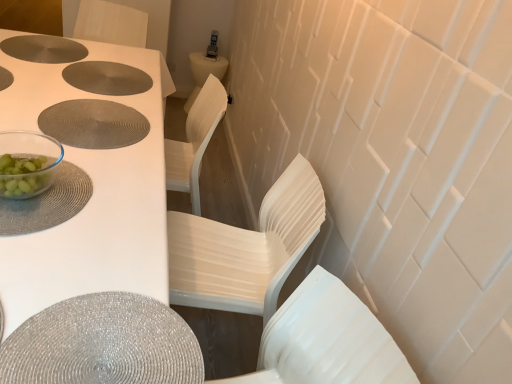
This screenshot has height=384, width=512. What do you see at coordinates (326, 340) in the screenshot?
I see `white plastic chair at center, acting as the second chair starting from the back` at bounding box center [326, 340].

In order to face matte silver placemat at center, the third hole positioned from the top, should I rotate leftwards or rightwards?

To face it directly, rotate left by 20.624 degrees.

Locate an element on the screen. white glossy table at upper left is located at coordinates (90, 200).

Where is `white plastic chair at center, the 2th chair viewed from the front`? The width and height of the screenshot is (512, 384). white plastic chair at center, the 2th chair viewed from the front is located at coordinates (246, 248).

You are a GUI agent. You are given a task and a screenshot of the screen. Output one action in this format:
    pyautogui.click(x=<x>, y=<y>)
    Task: Click on the shiny silver placemat at lower left
    
    Given the screenshot: What is the action you would take?
    pyautogui.click(x=103, y=344)

From the image's perspective, which is above, shiny silver placemat at lower left or matte gray placemat at upper left, which is counted as the second hole, starting from the top?

matte gray placemat at upper left, which is counted as the second hole, starting from the top, is shown above in the image.

In terms of width, does shiny silver placemat at lower left look wider or thinner when compared to matte gray placemat at upper left, the second hole positioned from the bottom?

In the image, shiny silver placemat at lower left appears to be wider than matte gray placemat at upper left, the second hole positioned from the bottom.

Between shiny silver placemat at lower left and matte gray placemat at upper left, the second hole positioned from the bottom, which one is positioned behind?

matte gray placemat at upper left, the second hole positioned from the bottom, is behind.

Which of these two, matte gray placemat at upper left, the 1th hole in the top-to-bottom sequence, or shiny silver placemat at lower left, stands taller?

shiny silver placemat at lower left.

From the picture: Measure the distance from matte gray placemat at upper left, placed as the 3th hole when sorted from bottom to top, to shiny silver placemat at lower left.

matte gray placemat at upper left, placed as the 3th hole when sorted from bottom to top, and shiny silver placemat at lower left are 4.54 feet apart.

Would you say shiny silver placemat at lower left is part of matte gray placemat at upper left, placed as the 3th hole when sorted from bottom to top,'s contents?

No, shiny silver placemat at lower left is not surrounded by matte gray placemat at upper left, placed as the 3th hole when sorted from bottom to top.

Find the location of a particular element. The image size is (512, 384). round table below the matte gray placemat at upper left, the 1th hole in the top-to-bottom sequence (from a real-world perspective) is located at coordinates (103, 344).

The width and height of the screenshot is (512, 384). Identify the location of chair that is the 1st object located in front of the matte gray placemat at upper left, which is counted as the second hole, starting from the top. (x=246, y=248).

Considering the relative sizes of white plastic chair at center, the 2th chair viewed from the front, and matte gray placemat at upper left, the second hole positioned from the bottom, in the image provided, is white plastic chair at center, the 2th chair viewed from the front, taller than matte gray placemat at upper left, the second hole positioned from the bottom,?

Indeed, white plastic chair at center, the 2th chair viewed from the front, has a greater height compared to matte gray placemat at upper left, the second hole positioned from the bottom.

Is white plastic chair at center, the 2th chair viewed from the front, to the left of matte gray placemat at upper left, which is counted as the second hole, starting from the top, from the viewer's perspective?

No, white plastic chair at center, the 2th chair viewed from the front, is not to the left of matte gray placemat at upper left, which is counted as the second hole, starting from the top.

Between white plastic chair at center, the 2th chair viewed from the front, and matte gray placemat at upper left, which is counted as the second hole, starting from the top, which one has smaller size?

With smaller size is matte gray placemat at upper left, which is counted as the second hole, starting from the top.

Can you confirm if white plastic chair at center, the first chair viewed from the front, is wider than green glass bowl at upper left?

Correct, the width of white plastic chair at center, the first chair viewed from the front, exceeds that of green glass bowl at upper left.

How far apart are white plastic chair at center, the first chair viewed from the front, and green glass bowl at upper left?

white plastic chair at center, the first chair viewed from the front, and green glass bowl at upper left are 30.65 inches apart.

From the image's perspective, which object appears higher, white plastic chair at center, acting as the second chair starting from the back, or green glass bowl at upper left?

green glass bowl at upper left, from the image's perspective.

The image size is (512, 384). I want to click on the 2nd chair positioned below the green glass bowl at upper left (from the image's perspective), so click(x=326, y=340).

Measure the distance from matte gray placemat at upper left, the second hole positioned from the bottom, to shiny silver placemat at lower left.

matte gray placemat at upper left, the second hole positioned from the bottom, and shiny silver placemat at lower left are 1.11 meters apart from each other.

Is matte gray placemat at upper left, which is counted as the second hole, starting from the top, outside of shiny silver placemat at lower left?

Yes, matte gray placemat at upper left, which is counted as the second hole, starting from the top, is outside of shiny silver placemat at lower left.

Considering the relative positions of matte gray placemat at upper left, the second hole positioned from the bottom, and shiny silver placemat at lower left in the image provided, is matte gray placemat at upper left, the second hole positioned from the bottom, to the left of shiny silver placemat at lower left from the viewer's perspective?

Yes.

Considering the relative sizes of matte gray placemat at upper left, the second hole positioned from the bottom, and shiny silver placemat at lower left in the image provided, is matte gray placemat at upper left, the second hole positioned from the bottom, wider than shiny silver placemat at lower left?

No.

Who is taller, matte silver placemat at center, which ranks as the first hole in bottom-to-top order, or shiny silver placemat at lower left?

Standing taller between the two is matte silver placemat at center, which ranks as the first hole in bottom-to-top order.

Between matte silver placemat at center, which ranks as the first hole in bottom-to-top order, and shiny silver placemat at lower left, which one has smaller width?

With smaller width is matte silver placemat at center, which ranks as the first hole in bottom-to-top order.

In the image, is matte silver placemat at center, which ranks as the first hole in bottom-to-top order, positioned in front of or behind shiny silver placemat at lower left?

matte silver placemat at center, which ranks as the first hole in bottom-to-top order, is behind shiny silver placemat at lower left.

Is matte silver placemat at center, which ranks as the first hole in bottom-to-top order, oriented towards shiny silver placemat at lower left?

No, matte silver placemat at center, which ranks as the first hole in bottom-to-top order, is not aimed at shiny silver placemat at lower left.

From a real-world perspective, who is located higher, white plastic chair at center, the first chair positioned from the back, or white plastic chair at center, the first chair viewed from the front?

In real-world perspective, white plastic chair at center, the first chair viewed from the front, is above.

From the picture: Can we say white plastic chair at center, the 2th chair viewed from the front, lies outside white plastic chair at center, acting as the second chair starting from the back?

white plastic chair at center, the 2th chair viewed from the front, lies outside white plastic chair at center, acting as the second chair starting from the back,'s area.

Image resolution: width=512 pixels, height=384 pixels. I want to click on chair on the right side of white plastic chair at center, the 2th chair viewed from the front, so click(326, 340).

Is white plastic chair at center, the first chair positioned from the back, positioned behind white plastic chair at center, the first chair viewed from the front?

Yes, the depth of white plastic chair at center, the first chair positioned from the back, is greater than that of white plastic chair at center, the first chair viewed from the front.

Where is `the 2nd hole behind the shiny silver placemat at lower left, starting your count from the anchor`? This screenshot has width=512, height=384. the 2nd hole behind the shiny silver placemat at lower left, starting your count from the anchor is located at coordinates (106, 78).

In the image, there is a matte gray placemat at upper left, placed as the 3th hole when sorted from bottom to top. Identify the location of round table below it (from the image's perspective). [103, 344].

When comparing their distances from matte silver placemat at center, the third hole positioned from the top, does white plastic chair at center, the first chair positioned from the back, or matte gray placemat at upper left, which is counted as the second hole, starting from the top, seem further?

white plastic chair at center, the first chair positioned from the back, lies further to matte silver placemat at center, the third hole positioned from the top, than the other object.

From the image, which object appears to be farther from matte gray placemat at upper left, which is counted as the second hole, starting from the top, white glossy table at upper left or shiny silver placemat at lower left?

The object further to matte gray placemat at upper left, which is counted as the second hole, starting from the top, is shiny silver placemat at lower left.

Which object lies nearer to the anchor point white plastic chair at center, the 2th chair viewed from the front, green glass bowl at upper left or matte gray placemat at upper left, the second hole positioned from the bottom?

green glass bowl at upper left lies closer to white plastic chair at center, the 2th chair viewed from the front, than the other object.

Considering their positions, is white glossy table at upper left positioned further to green glass bowl at upper left than matte gray placemat at upper left, placed as the 3th hole when sorted from bottom to top?

matte gray placemat at upper left, placed as the 3th hole when sorted from bottom to top.

Looking at the image, which one is located further to matte silver placemat at center, which ranks as the first hole in bottom-to-top order, matte gray placemat at upper left, which is counted as the second hole, starting from the top, or white plastic chair at center, the first chair positioned from the back?

white plastic chair at center, the first chair positioned from the back, is further to matte silver placemat at center, which ranks as the first hole in bottom-to-top order.

Considering their positions, is white glossy table at upper left positioned closer to white plastic chair at center, acting as the second chair starting from the back, than green glass bowl at upper left?

The object closer to white plastic chair at center, acting as the second chair starting from the back, is white glossy table at upper left.

Estimate the real-world distances between objects in this image. Which object is closer to green glass bowl at upper left, matte silver placemat at center, which ranks as the first hole in bottom-to-top order, or white plastic chair at center, acting as the second chair starting from the back?

matte silver placemat at center, which ranks as the first hole in bottom-to-top order, is closer to green glass bowl at upper left.

Looking at the image, which one is located further to white plastic chair at center, the first chair positioned from the back, matte silver placemat at center, the third hole positioned from the top, or white glossy table at upper left?

The object further to white plastic chair at center, the first chair positioned from the back, is matte silver placemat at center, the third hole positioned from the top.

The width and height of the screenshot is (512, 384). Identify the location of chair between shiny silver placemat at lower left and white plastic chair at center, the 2th chair viewed from the front, along the z-axis. (326, 340).

This screenshot has width=512, height=384. I want to click on hole between white glossy table at upper left and matte gray placemat at upper left, the second hole positioned from the bottom, in the front-back direction, so click(93, 124).

Find the location of a particular element. round table between white glossy table at upper left and white plastic chair at center, the first chair positioned from the back, from left to right is located at coordinates (103, 344).

Locate an element on the screen. The image size is (512, 384). tableware between white plastic chair at center, acting as the second chair starting from the back, and matte gray placemat at upper left, which is counted as the second hole, starting from the top, from front to back is located at coordinates (27, 163).